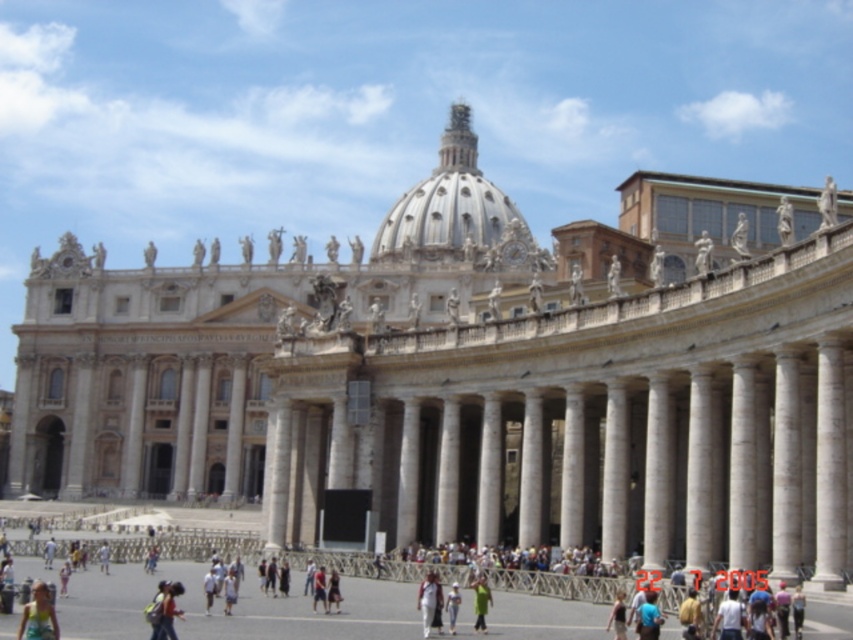
Question: Which object is positioned farthest from the green matte jacket at center?

Choices:
 (A) light brown fabric pants at center
 (B) light blue denim jeans at center

Answer: (A)

Question: Can you confirm if light brown fabric bag at lower center is positioned to the left of light brown fabric dress at center?

Choices:
 (A) no
 (B) yes

Answer: (B)

Question: Can you confirm if light yellow fabric dress at lower left is wider than green matte jacket at center?

Choices:
 (A) yes
 (B) no

Answer: (A)

Question: Which object appears closest to the camera in this image?

Choices:
 (A) light yellow fabric dress at lower left
 (B) light blue denim jeans at center
 (C) blue fabric shirt at center
 (D) green matte jacket at center

Answer: (A)

Question: Can you confirm if light brown fabric bag at lower center is thinner than green matte jacket at center?

Choices:
 (A) yes
 (B) no

Answer: (A)

Question: Which point appears closest to the camera in this image?

Choices:
 (A) [426, 628]
 (B) [454, 604]
 (C) [619, 600]
 (D) [474, 627]

Answer: (A)